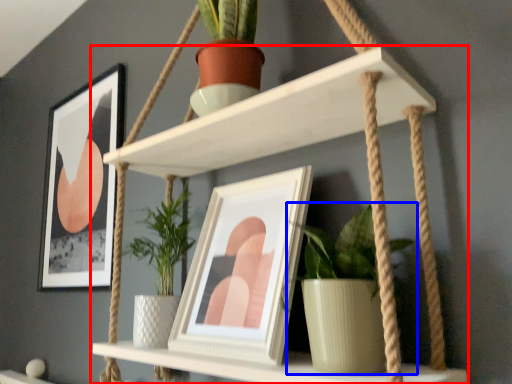
Question: Which of the following is the closest to the observer, shelf (highlighted by a red box) or houseplant (highlighted by a blue box)?

Choices:
 (A) shelf
 (B) houseplant

Answer: (A)